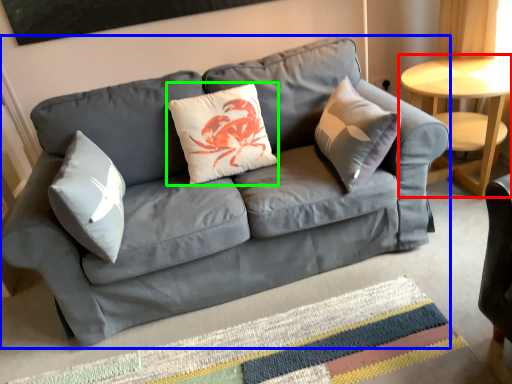
Question: Based on their relative distances, which object is nearer to table (highlighted by a red box)? Choose from studio couch (highlighted by a blue box) and pillow (highlighted by a green box).

Choices:
 (A) studio couch
 (B) pillow

Answer: (A)